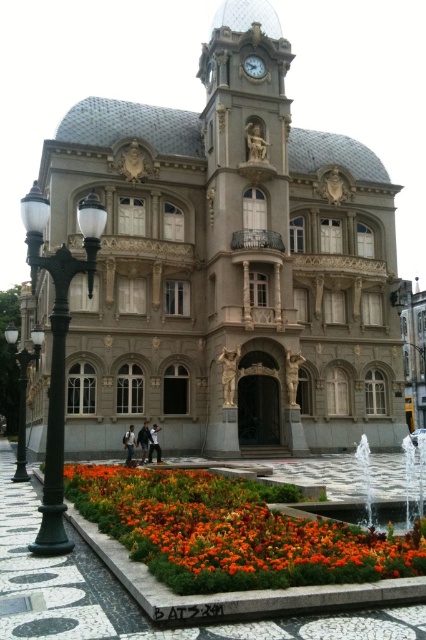
Question: Which object appears farthest from the camera in this image?

Choices:
 (A) gold metallic clock at upper center
 (B) black metal lamp post at left
 (C) matte gray palace at center
 (D) green polished metal streetlamp at left

Answer: (A)

Question: Is vibrant orange petals at lower center positioned at the back of gold metallic clock at upper center?

Choices:
 (A) no
 (B) yes

Answer: (A)

Question: Can you confirm if vibrant orange petals at lower center is positioned below green polished metal streetlamp at left?

Choices:
 (A) no
 (B) yes

Answer: (B)

Question: Which object is positioned closest to the black metal lamp post at left?

Choices:
 (A) green polished metal streetlamp at left
 (B) gold metallic clock at upper center

Answer: (A)

Question: Which point is closer to the camera?

Choices:
 (A) (256, 74)
 (B) (57, 509)
 (C) (39, 333)

Answer: (B)

Question: Is vibrant orange petals at lower center above green polished metal streetlamp at left?

Choices:
 (A) yes
 (B) no

Answer: (B)